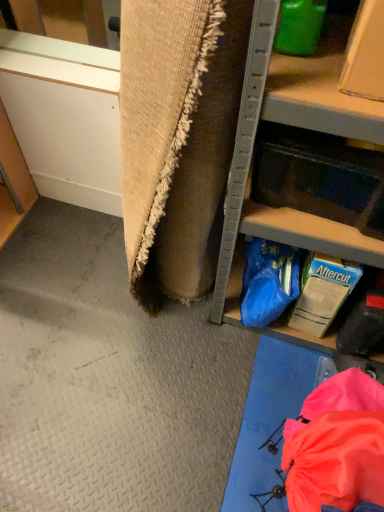
Question: Can you confirm if translucent plastic drawer at lower right is positioned to the right of metallic gray shelf at right?

Choices:
 (A) yes
 (B) no

Answer: (B)

Question: Can you confirm if translucent plastic drawer at lower right is smaller than metallic gray shelf at right?

Choices:
 (A) yes
 (B) no

Answer: (A)

Question: Can you confirm if translucent plastic drawer at lower right is shorter than metallic gray shelf at right?

Choices:
 (A) no
 (B) yes

Answer: (B)

Question: Is translucent plastic drawer at lower right turned away from metallic gray shelf at right?

Choices:
 (A) yes
 (B) no

Answer: (A)

Question: Is translucent plastic drawer at lower right thinner than metallic gray shelf at right?

Choices:
 (A) no
 (B) yes

Answer: (B)

Question: Is translucent plastic drawer at lower right further to the viewer compared to metallic gray shelf at right?

Choices:
 (A) no
 (B) yes

Answer: (B)

Question: From the image's perspective, is metallic gray shelf at right above translucent plastic drawer at lower right?

Choices:
 (A) yes
 (B) no

Answer: (A)

Question: Does metallic gray shelf at right have a larger size compared to translucent plastic drawer at lower right?

Choices:
 (A) no
 (B) yes

Answer: (B)

Question: Is metallic gray shelf at right facing away from translucent plastic drawer at lower right?

Choices:
 (A) no
 (B) yes

Answer: (B)

Question: Does metallic gray shelf at right come behind translucent plastic drawer at lower right?

Choices:
 (A) no
 (B) yes

Answer: (A)

Question: Is metallic gray shelf at right smaller than translucent plastic drawer at lower right?

Choices:
 (A) no
 (B) yes

Answer: (A)

Question: From a real-world perspective, is metallic gray shelf at right positioned under translucent plastic drawer at lower right based on gravity?

Choices:
 (A) no
 (B) yes

Answer: (B)

Question: Would you say metallic gray shelf at right is to the left or to the right of translucent plastic drawer at lower right in the picture?

Choices:
 (A) left
 (B) right

Answer: (B)